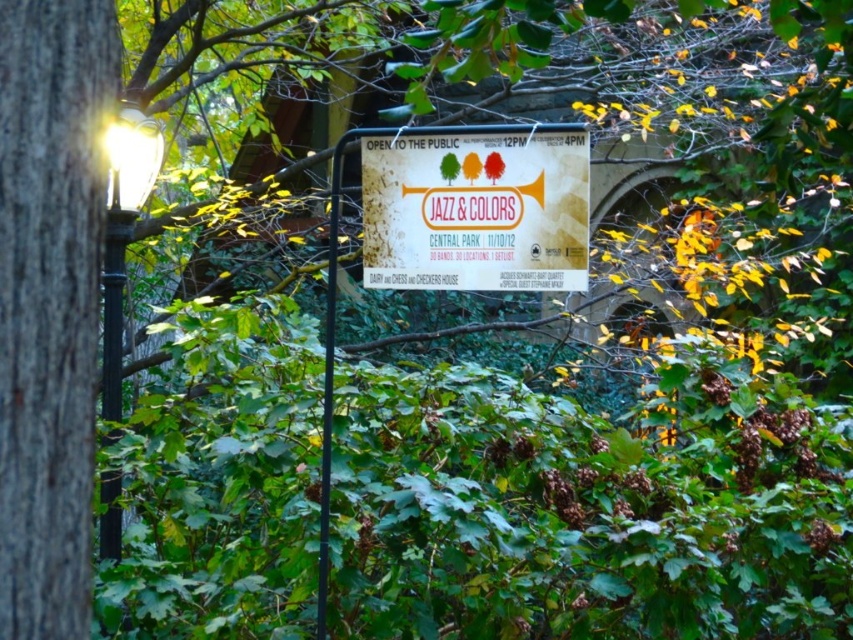
You are a GUI agent. You are given a task and a screenshot of the screen. Output one action in this format:
    pyautogui.click(x=<x>, y=<y>)
    Task: Click on the white paper sign at center
    
    Given the screenshot: What is the action you would take?
    pyautogui.click(x=476, y=211)

Is point (541, 268) positioned in front of point (113, 308)?

Yes, point (541, 268) is closer to viewer.

Find the location of a particular element. This screenshot has height=640, width=853. white paper sign at center is located at coordinates (476, 211).